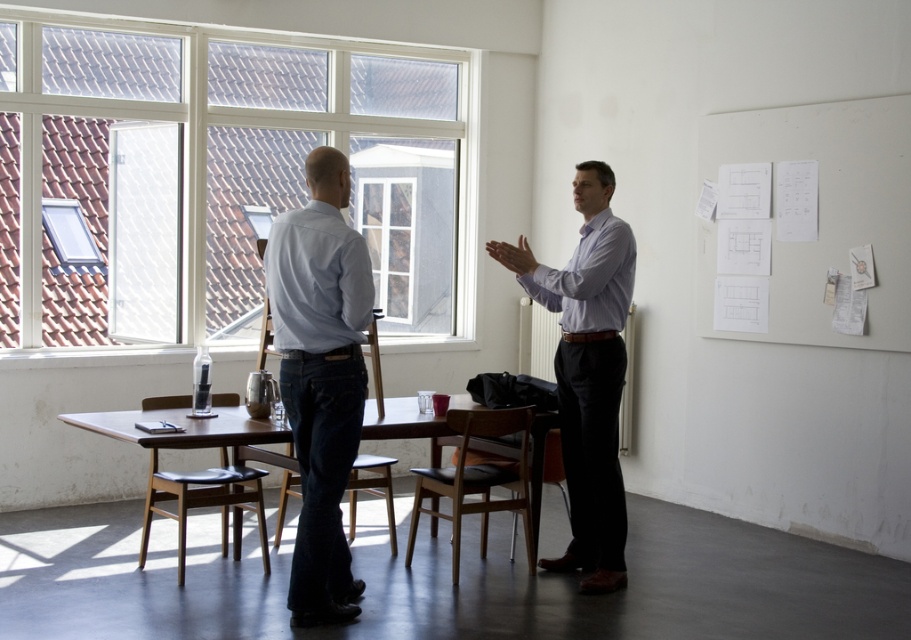
Is light brown wooden table at center in front of light brown wood chair at center?

Yes, light brown wooden table at center is in front of light brown wood chair at center.

Can you confirm if light brown wooden table at center is shorter than light brown wood chair at center?

Yes, light brown wooden table at center is shorter than light brown wood chair at center.

The width and height of the screenshot is (911, 640). What do you see at coordinates (185, 428) in the screenshot?
I see `light brown wooden table at center` at bounding box center [185, 428].

Locate an element on the screen. The image size is (911, 640). light brown wooden table at center is located at coordinates (185, 428).

Between point (445, 256) and point (771, 300), which one is positioned in front?

Positioned in front is point (771, 300).

Based on the photo, can you confirm if clear glass window at upper left is positioned to the left of white paper at upper right?

Yes, clear glass window at upper left is to the left of white paper at upper right.

Looking at this image, who is more distant from viewer, (x=293, y=180) or (x=820, y=156)?

The point (x=293, y=180) is behind.

Where is `clear glass window at upper left`? clear glass window at upper left is located at coordinates (198, 173).

Locate an element on the screen. The image size is (911, 640). light brown wood chair at center is located at coordinates (477, 480).

Can you confirm if light brown wood chair at center is positioned to the right of dark wood chair at center?

Yes, light brown wood chair at center is to the right of dark wood chair at center.

Who is more forward, (500, 509) or (233, 547)?

Point (500, 509) is in front.

The height and width of the screenshot is (640, 911). Identify the location of light brown wood chair at center. (477, 480).